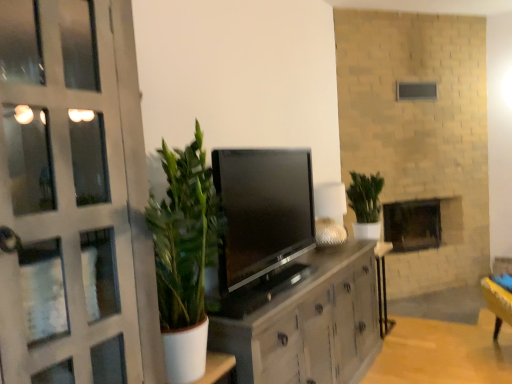
Question: From a real-world perspective, is matte white cabinet at center located higher than green leafy plant at center?

Choices:
 (A) no
 (B) yes

Answer: (A)

Question: Is green leafy plant at center completely or partially inside matte white cabinet at center?

Choices:
 (A) yes
 (B) no

Answer: (B)

Question: Is matte white cabinet at center not near green leafy plant at center?

Choices:
 (A) no
 (B) yes

Answer: (B)

Question: From the image's perspective, is matte white cabinet at center below green leafy plant at center?

Choices:
 (A) no
 (B) yes

Answer: (B)

Question: Does matte white cabinet at center have a lesser width compared to green leafy plant at center?

Choices:
 (A) no
 (B) yes

Answer: (A)

Question: Is matte white cabinet at center to the right of green leafy plant at center from the viewer's perspective?

Choices:
 (A) yes
 (B) no

Answer: (B)

Question: Can you confirm if wooden table at center is shorter than green leafy plant at center?

Choices:
 (A) yes
 (B) no

Answer: (B)

Question: From the image's perspective, is wooden table at center on top of green leafy plant at center?

Choices:
 (A) no
 (B) yes

Answer: (A)

Question: Is wooden table at center at the left side of green leafy plant at center?

Choices:
 (A) no
 (B) yes

Answer: (A)

Question: Can you confirm if wooden table at center is thinner than green leafy plant at center?

Choices:
 (A) no
 (B) yes

Answer: (B)

Question: From the image's perspective, does wooden table at center appear lower than green leafy plant at center?

Choices:
 (A) no
 (B) yes

Answer: (B)

Question: Is wooden table at center outside of green leafy plant at center?

Choices:
 (A) no
 (B) yes

Answer: (B)

Question: Does satin black tv at center turn towards brick fireplace at center?

Choices:
 (A) yes
 (B) no

Answer: (B)